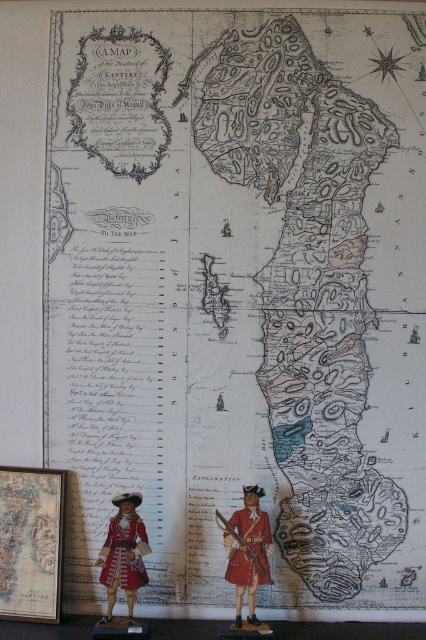
Question: Which of the following is the closest to the observer?

Choices:
 (A) matte red uniform at lower left
 (B) shiny red uniform at center

Answer: (B)

Question: Observing the image, what is the correct spatial positioning of shiny red uniform at center in reference to matte red uniform at lower left?

Choices:
 (A) below
 (B) above

Answer: (B)

Question: Is shiny red uniform at center wider than matte red uniform at lower left?

Choices:
 (A) yes
 (B) no

Answer: (B)

Question: Which point is closer to the camera taking this photo?

Choices:
 (A) (120, 529)
 (B) (249, 561)

Answer: (B)

Question: Is shiny red uniform at center thinner than matte red uniform at lower left?

Choices:
 (A) yes
 (B) no

Answer: (A)

Question: Which point is closer to the camera taking this photo?

Choices:
 (A) (262, 545)
 (B) (141, 540)

Answer: (A)